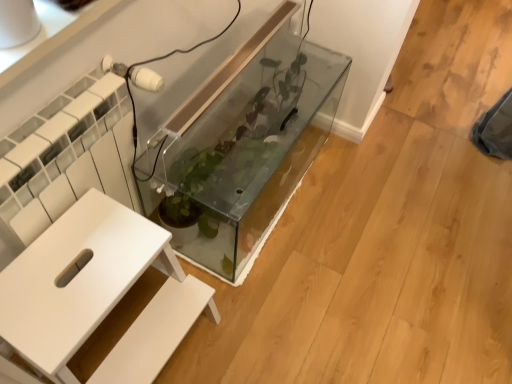
Identify the location of free spot to the right of transparent glass tank at center. The image size is (512, 384). (386, 212).